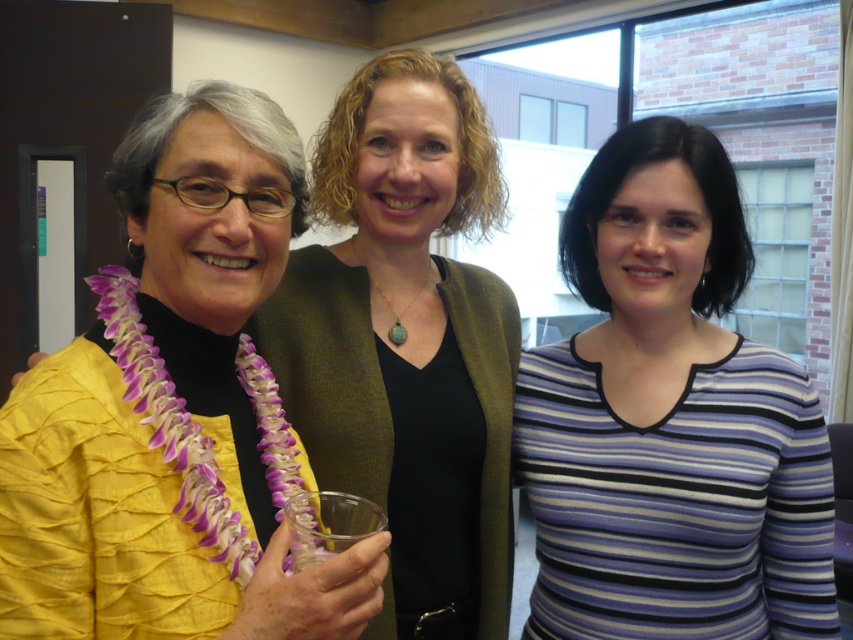
You are a fashion designer observing the image. You need to determine which clothing item has a greater width between the striped cotton shirt at center and the yellow pleated blouse at left. Which one is wider?

The striped cotton shirt at center is wider than the yellow pleated blouse at left according to the description.

You are a fashion designer observing the image. You need to determine which clothing item is smaller in size between the striped cotton shirt at center and the yellow pleated blouse at left. Which one is smaller?

The striped cotton shirt at center is smaller in size compared to the yellow pleated blouse at left according to the description.